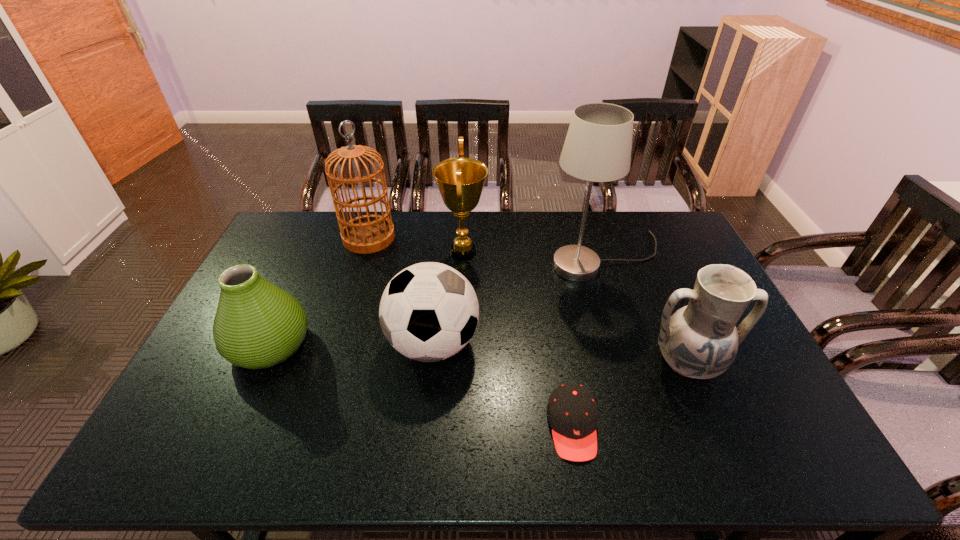
The image size is (960, 540). In order to click on vacant space in between the nearest object and the vase in this screenshot , I will do `click(421, 386)`.

The image size is (960, 540). I want to click on vacant space in between the vase and the third tallest object, so click(367, 298).

The width and height of the screenshot is (960, 540). Identify the location of unoccupied position between the vase and the fifth shortest object. (367, 298).

Where is `free space that is in between the soccer ball and the cap`? This screenshot has width=960, height=540. free space that is in between the soccer ball and the cap is located at coordinates pyautogui.click(x=503, y=385).

Where is `unoccupied area between the soccer ball and the vase`? The image size is (960, 540). unoccupied area between the soccer ball and the vase is located at coordinates (351, 344).

The width and height of the screenshot is (960, 540). In order to click on unoccupied position between the nearest object and the soccer ball in this screenshot , I will do `click(503, 385)`.

At what (x,y) coordinates should I click in order to perform the action: click on the sixth closest object relative to the birdcage. Please return your answer as a coordinate pair (x, y). Looking at the image, I should click on (700, 340).

Identify which object is the fifth closest to the award. Please provide its 2D coordinates. Your answer should be formatted as a tuple, i.e. [(x, y)], where the tuple contains the x and y coordinates of a point satisfying the conditions above.

[(572, 412)]

This screenshot has height=540, width=960. I want to click on vacant space that satisfies the following two spatial constraints: 1. on the front view with handles of the fifth shortest object; 2. on the back side of the table lamp, so (463, 257).

Where is `vacant space that satisfies the following two spatial constraints: 1. on the front side of the table lamp; 2. on the right side of the birdcage`? This screenshot has height=540, width=960. vacant space that satisfies the following two spatial constraints: 1. on the front side of the table lamp; 2. on the right side of the birdcage is located at coordinates (363, 257).